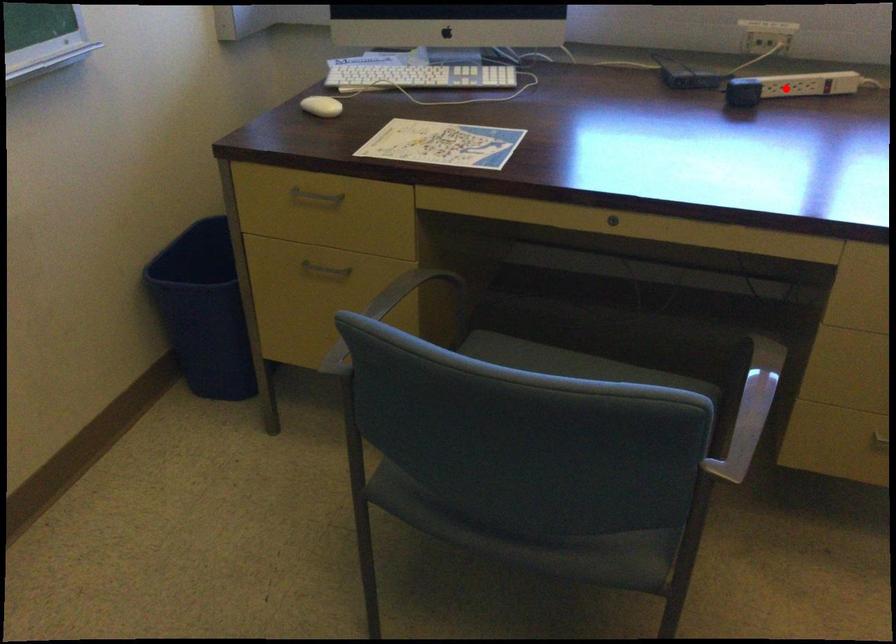
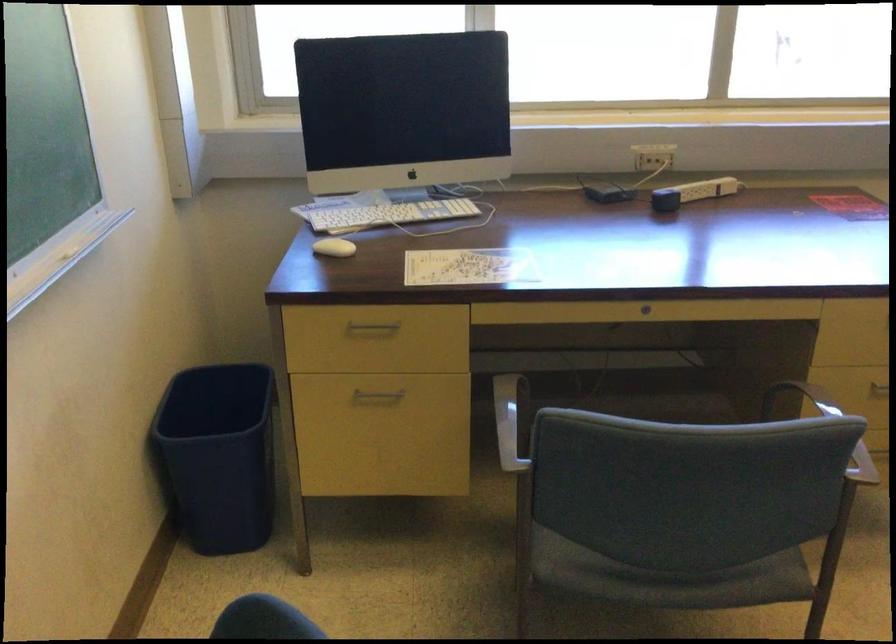
Question: I am providing you with two images of the same scene from different viewpoints. Given a red point in image1, look at the same physical point in image2. Is it:

Choices:
 (A) Closer to the viewpoint
 (B) Farther from the viewpoint

Answer: (B)